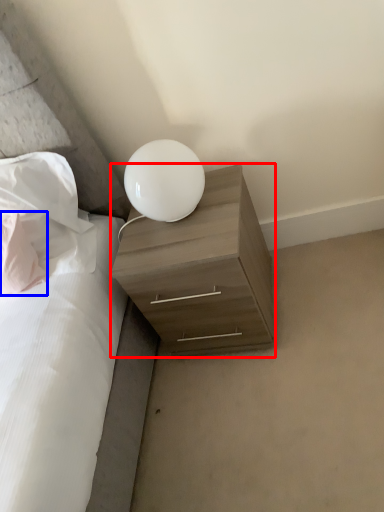
Question: Which point is closer to the camera, nightstand (highlighted by a red box) or pillow (highlighted by a blue box)?

Choices:
 (A) nightstand
 (B) pillow

Answer: (A)